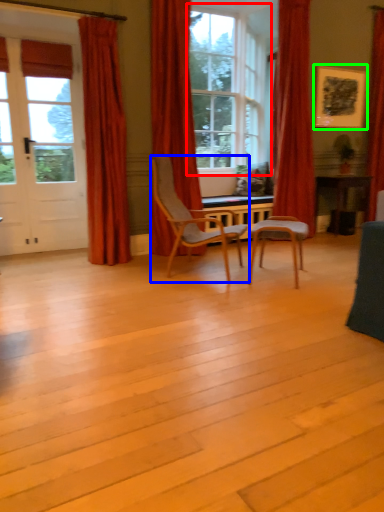
Question: Which object is positioned farthest from window (highlighted by a red box)? Select from chair (highlighted by a blue box) and picture frame (highlighted by a green box).

Choices:
 (A) chair
 (B) picture frame

Answer: (A)